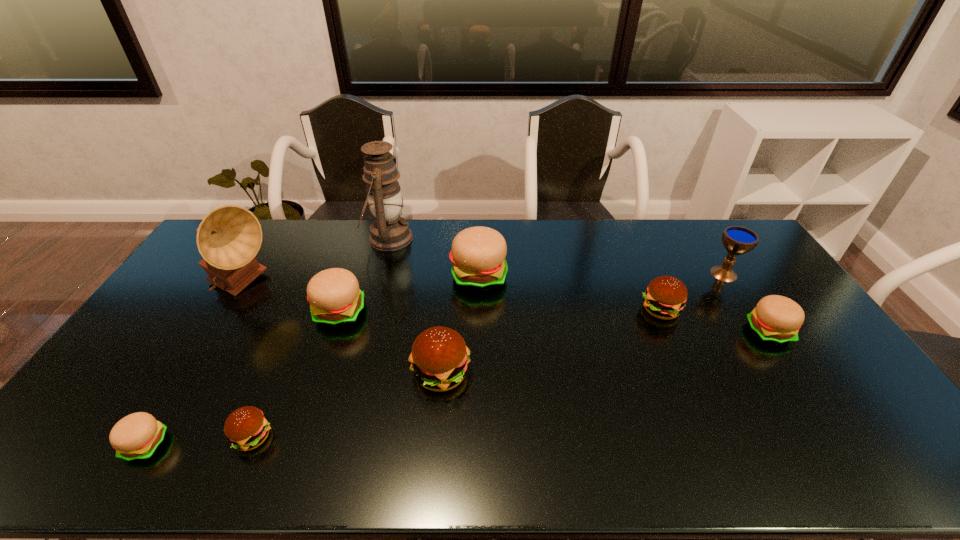
The image size is (960, 540). I want to click on free point between the smallest brown hamburger and the third smallest beige hamburger, so click(x=296, y=375).

The image size is (960, 540). Find the location of `free space between the phonograph record and the biggest beige hamburger`. free space between the phonograph record and the biggest beige hamburger is located at coordinates (360, 281).

You are a GUI agent. You are given a task and a screenshot of the screen. Output one action in this format:
    pyautogui.click(x=<x>, y=<y>)
    Task: Click on the blank region between the rightmost hamburger and the farthest beige hamburger
    
    Given the screenshot: What is the action you would take?
    pyautogui.click(x=623, y=304)

Select which object is the fifth closest to the second brown hamburger from left to right. Please provide its 2D coordinates. Your answer should be formatted as a tuple, i.e. [(x, y)], where the tuple contains the x and y coordinates of a point satisfying the conditions above.

[(229, 237)]

Identify which object is located as the sixth nearest to the oil lamp. Please provide its 2D coordinates. Your answer should be formatted as a tuple, i.e. [(x, y)], where the tuple contains the x and y coordinates of a point satisfying the conditions above.

[(137, 436)]

Identify which hamburger is the third nearest to the second smallest brown hamburger. Please provide its 2D coordinates. Your answer should be formatted as a tuple, i.e. [(x, y)], where the tuple contains the x and y coordinates of a point satisfying the conditions above.

[(439, 358)]

The image size is (960, 540). What are the coordinates of `hamburger that is the sixth nearest to the biggest beige hamburger` in the screenshot? It's located at (137, 436).

This screenshot has width=960, height=540. I want to click on beige hamburger identified as the second closest to the leftmost brown hamburger, so click(x=335, y=299).

Locate an element on the screen. beige hamburger identified as the third closest to the rightmost beige hamburger is located at coordinates (137, 436).

Identify which brown hamburger is the second closest to the rightmost hamburger. Please provide its 2D coordinates. Your answer should be formatted as a tuple, i.e. [(x, y)], where the tuple contains the x and y coordinates of a point satisfying the conditions above.

[(439, 358)]